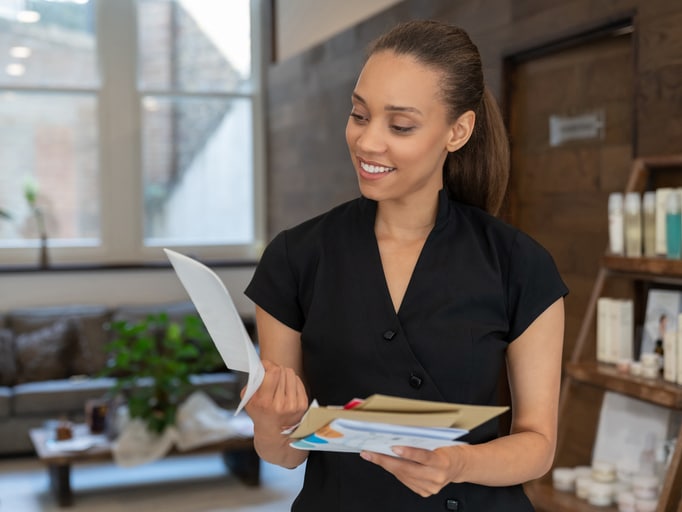
Locate an element on the screen. The width and height of the screenshot is (682, 512). plant is located at coordinates (166, 373).